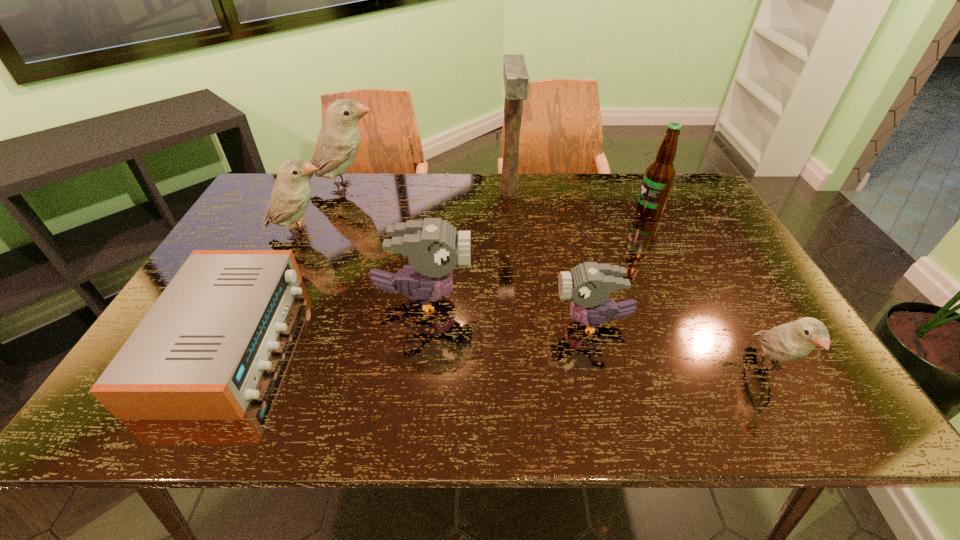
At what (x,y) coordinates should I click in order to perform the action: click on vacant area located at the face of the fifth nearest object. Please return your answer as a coordinate pair (x, y). The image size is (960, 540). Looking at the image, I should click on (406, 234).

Locate an element on the screen. The image size is (960, 540). free space located at the beak of the left gray bird is located at coordinates (619, 299).

I want to click on free location located at the face of the smallest white bird, so click(x=800, y=422).

The image size is (960, 540). In order to click on vacant region located at the beak of the right gray bird in this screenshot , I will do `click(470, 322)`.

Where is `free space located at the beak of the right gray bird`? The image size is (960, 540). free space located at the beak of the right gray bird is located at coordinates (513, 322).

The width and height of the screenshot is (960, 540). In order to click on free point located 0.300m at the beak of the right gray bird in this screenshot , I will do `click(428, 322)`.

This screenshot has width=960, height=540. Find the location of `vacant region located 0.300m on the control panel of the radio receiver`. vacant region located 0.300m on the control panel of the radio receiver is located at coordinates (417, 339).

Locate an element on the screen. mallet situated at the far edge is located at coordinates (516, 80).

You are a GUI agent. You are given a task and a screenshot of the screen. Output one action in this format:
    pyautogui.click(x=<x>, y=<y>)
    Task: Click on the bird located in the far edge section of the desktop
    
    Given the screenshot: What is the action you would take?
    pyautogui.click(x=338, y=142)

Locate an element on the screen. The image size is (960, 540). beer bottle positioned at the far edge is located at coordinates pos(658,180).